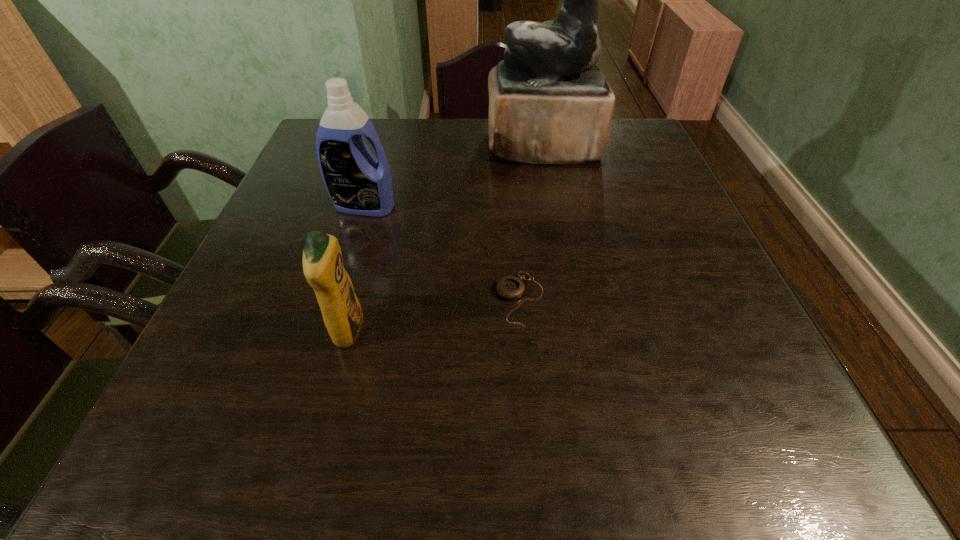
The width and height of the screenshot is (960, 540). What are the coordinates of `free point between the farthest object and the third nearest object` in the screenshot? It's located at (453, 176).

At what (x,y) coordinates should I click in order to perform the action: click on vacant space that is in between the farther detergent and the sculpture. Please return your answer as a coordinate pair (x, y). This screenshot has height=540, width=960. Looking at the image, I should click on (453, 176).

You are a GUI agent. You are given a task and a screenshot of the screen. Output one action in this format:
    pyautogui.click(x=<x>, y=<y>)
    Task: Click on the object that stands as the closest to the sculpture
    This screenshot has height=540, width=960.
    Given the screenshot: What is the action you would take?
    pyautogui.click(x=358, y=183)

This screenshot has width=960, height=540. I want to click on the closest object relative to the shortest object, so click(323, 268).

The height and width of the screenshot is (540, 960). Find the location of `vacant space that satisfies the following two spatial constraints: 1. in a relaxed pose on the tallest object; 2. on the front side of the taller detergent`. vacant space that satisfies the following two spatial constraints: 1. in a relaxed pose on the tallest object; 2. on the front side of the taller detergent is located at coordinates (555, 207).

Identify the location of free location that satisfies the following two spatial constraints: 1. on the front side of the shortest object; 2. on the left side of the third nearest object. The image size is (960, 540). (337, 299).